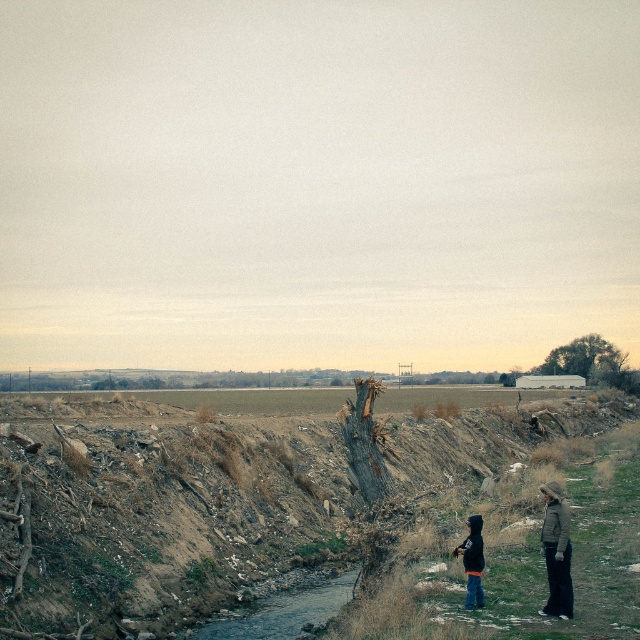
Which of these two, clear water at center or black matte jacket at lower right, stands taller?

black matte jacket at lower right

Between point (285, 589) and point (474, 572), which one is positioned behind?

The point (285, 589) is more distant.

Locate an element on the screen. clear water at center is located at coordinates (284, 611).

Is khaki woolen jacket at right to the left of black matte jacket at lower right from the viewer's perspective?

Incorrect, khaki woolen jacket at right is not on the left side of black matte jacket at lower right.

Is point (561, 557) closer to viewer compared to point (481, 595)?

Yes, point (561, 557) is closer to viewer.

Identify the location of khaki woolen jacket at right. This screenshot has height=640, width=640. (556, 552).

This screenshot has width=640, height=640. What do you see at coordinates (284, 611) in the screenshot?
I see `clear water at center` at bounding box center [284, 611].

Is point (312, 604) positioned after point (481, 604)?

That is True.

Is point (298, 628) in front of point (560, 589)?

That is False.

Locate an element on the screen. clear water at center is located at coordinates (284, 611).